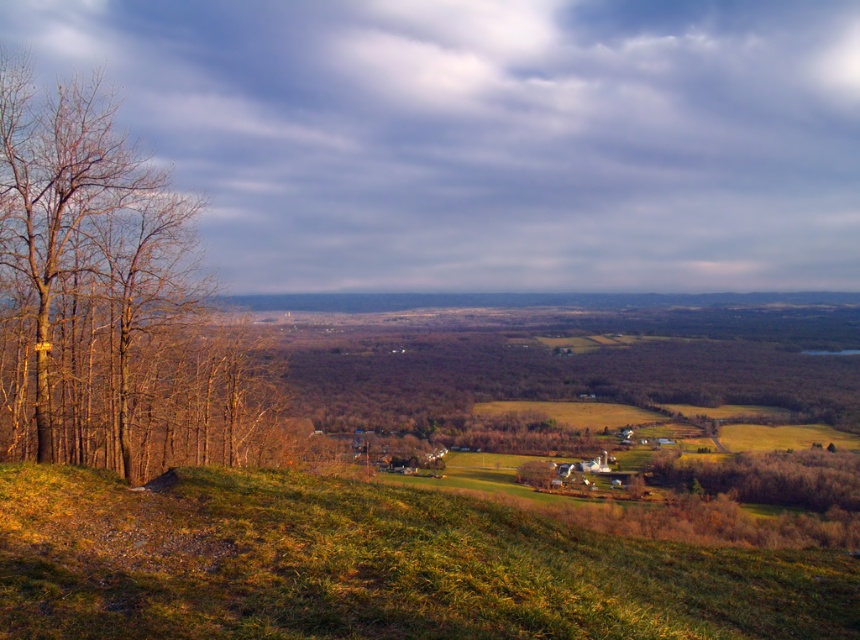
Looking at this image, you are a drone operator trying to capture a photo of the green grassy hillside at lower center. The drone is currently at coordinates point A. To ensure the hillside is centered in your shot, you need to adjust the drone to the correct coordinates. What are the coordinates you should aim for?

The coordinates for the green grassy hillside at lower center are point (x=372, y=566).

You are standing at the top of the green grassy hillside at lower center and want to walk down to the valley below. Which direction should you head relative to the green matte tree at center?

Since the green grassy hillside at lower center is positioned over the green matte tree at center, you should head downward away from the green matte tree at center to reach the valley below.